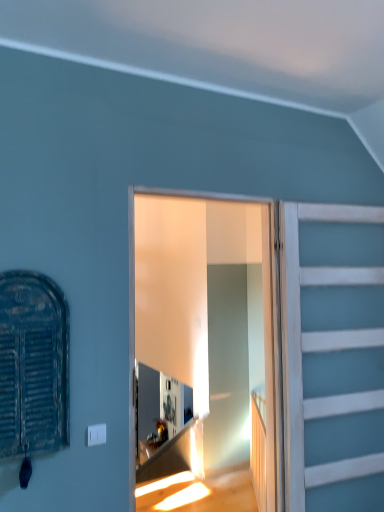
Question: Which is correct: clear glass door at center is inside rusty metal shutter at left, or outside of it?

Choices:
 (A) inside
 (B) outside

Answer: (B)

Question: From a real-world perspective, is clear glass door at center positioned above or below rusty metal shutter at left?

Choices:
 (A) above
 (B) below

Answer: (B)

Question: Which is farther from the clear glass door at center?

Choices:
 (A) white painted wood at right
 (B) rusty metal shutter at left

Answer: (B)

Question: Which is farther from the clear glass door at center?

Choices:
 (A) white painted wood at right
 (B) rusty metal shutter at left

Answer: (B)